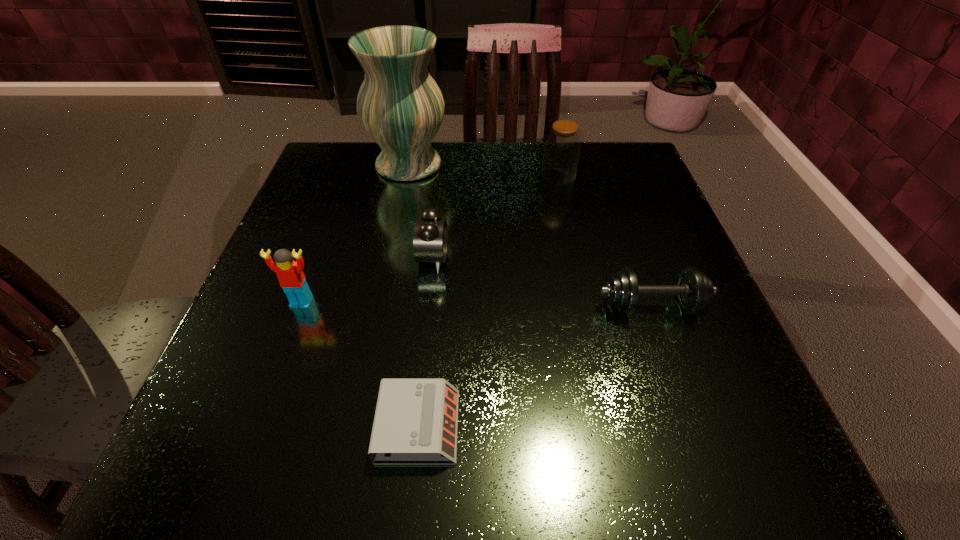
Identify the location of object located at the far left corner. (401, 107).

In the image, there is a desktop. Identify the location of vacant space at the far edge. This screenshot has height=540, width=960. (425, 190).

This screenshot has height=540, width=960. What are the coordinates of `vacant space at the near edge of the desktop` in the screenshot? It's located at (320, 434).

I want to click on vacant space at the left edge of the desktop, so click(x=350, y=246).

The width and height of the screenshot is (960, 540). I want to click on blank area at the right edge, so click(648, 206).

The width and height of the screenshot is (960, 540). Find the location of `free region at the near left corner of the desktop`. free region at the near left corner of the desktop is located at coordinates (280, 443).

The width and height of the screenshot is (960, 540). What are the coordinates of `vacant region at the far right corner of the desktop` in the screenshot? It's located at (588, 146).

The height and width of the screenshot is (540, 960). I want to click on vacant space at the near right corner of the desktop, so click(x=798, y=489).

Locate an element on the screen. vacant area that lies between the vase and the fourth tallest object is located at coordinates (420, 212).

At what (x,y) coordinates should I click in order to perform the action: click on free space between the leftmost object and the fourth nearest object. Please return your answer as a coordinate pair (x, y). This screenshot has height=540, width=960. Looking at the image, I should click on click(368, 280).